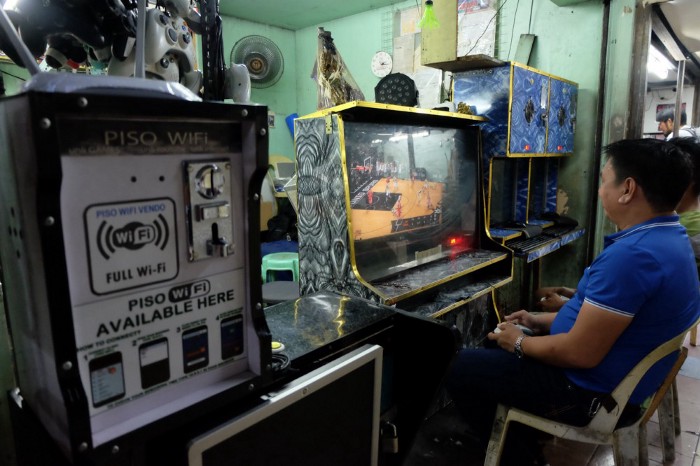
Locate an element on the screen. The image size is (700, 466). keyboard is located at coordinates (536, 239).